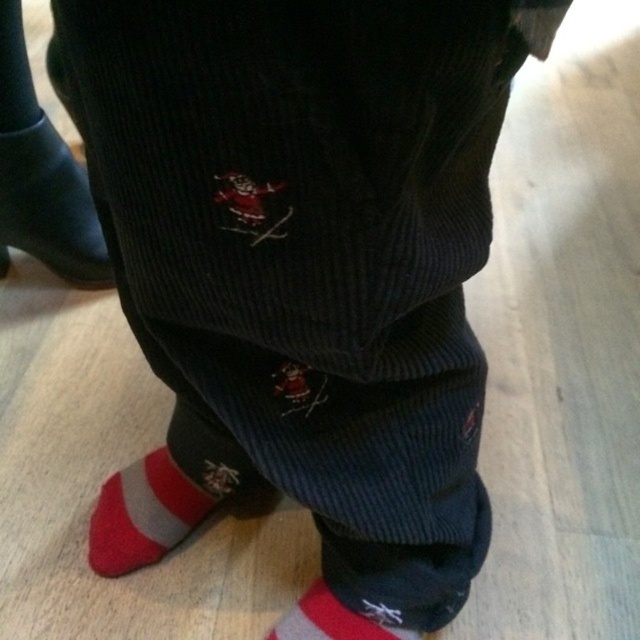
Question: Does matte black pants at center appear on the left side of red cotton sock at lower center?

Choices:
 (A) yes
 (B) no

Answer: (A)

Question: Which point is closer to the camera?

Choices:
 (A) (310, 624)
 (B) (1, 132)
 (C) (212, 500)

Answer: (A)

Question: Can you confirm if matte black pants at center is positioned below red cotton sock at lower center?

Choices:
 (A) yes
 (B) no

Answer: (B)

Question: Does matte black pants at center have a lesser width compared to red cotton sock at lower left?

Choices:
 (A) yes
 (B) no

Answer: (B)

Question: Which point is farther to the camera?

Choices:
 (A) matte black pants at center
 (B) red cotton sock at lower left
 (C) red cotton sock at lower center

Answer: (A)

Question: Which object is closer to the camera taking this photo?

Choices:
 (A) red cotton sock at lower center
 (B) matte black pants at center

Answer: (A)